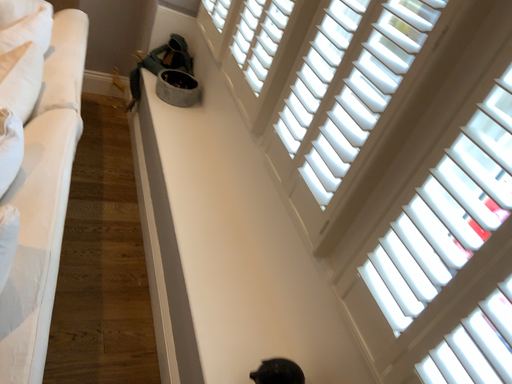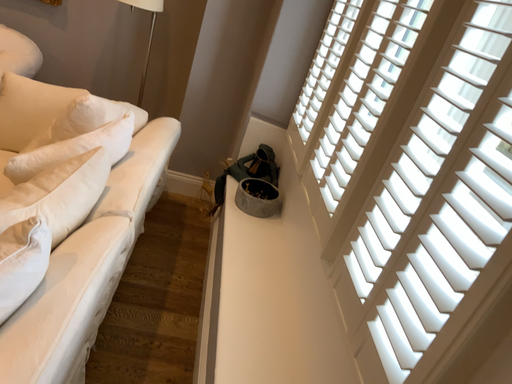
Question: Which way did the camera rotate in the video?

Choices:
 (A) rotated downward
 (B) rotated upward

Answer: (B)